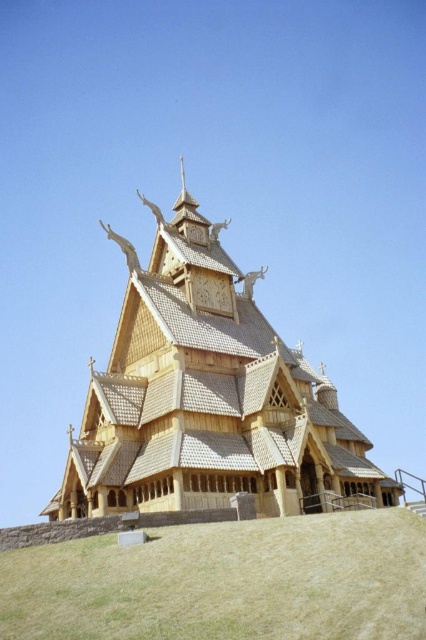
Does natural wood church at center appear on the left side of yellowish-green grass at lower center?

Incorrect, natural wood church at center is not on the left side of yellowish-green grass at lower center.

Who is more forward, (183, 282) or (396, 634)?

Point (396, 634) is more forward.

What do you see at coordinates (207, 396) in the screenshot? I see `natural wood church at center` at bounding box center [207, 396].

Locate an element on the screen. The width and height of the screenshot is (426, 640). natural wood church at center is located at coordinates (207, 396).